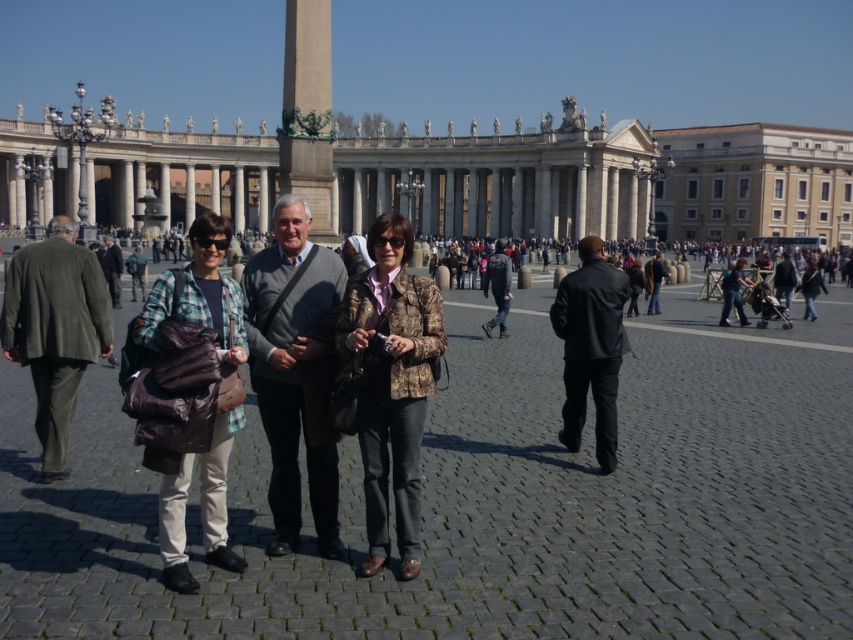
Question: Which of the following is the farthest from the observer?

Choices:
 (A) (251, 289)
 (B) (728, 285)

Answer: (B)

Question: Which object is the closest to the dark gray sweater at center?

Choices:
 (A) dark gray jacket at center
 (B) denim jacket at center
 (C) dark green suit at left
 (D) denim jacket at lower right

Answer: (C)

Question: Can you confirm if camouflage-patterned jacket at center is wider than denim jacket at center?

Choices:
 (A) yes
 (B) no

Answer: (B)

Question: Can you confirm if camouflage-patterned jacket at center is thinner than dark green suit at left?

Choices:
 (A) no
 (B) yes

Answer: (B)

Question: Is dark gray leather jacket at center thinner than denim jacket at center?

Choices:
 (A) yes
 (B) no

Answer: (A)

Question: Considering the real-world distances, which object is farthest from the denim jacket at lower right?

Choices:
 (A) denim jacket at center
 (B) dark gray sweater at center
 (C) plaid fabric shirt at center

Answer: (B)